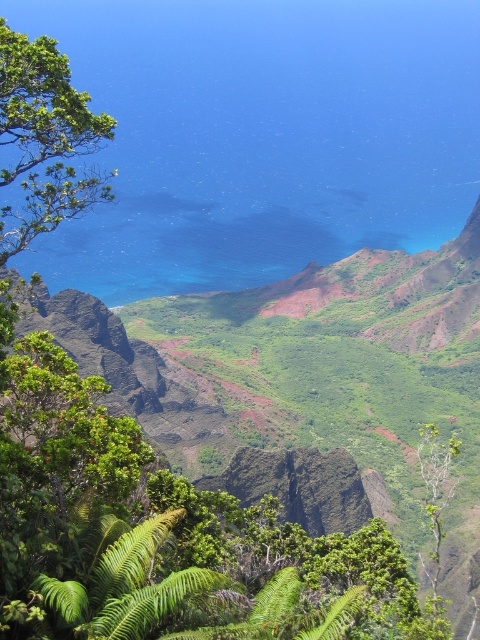
Question: Which point is closer to the camera taking this photo?

Choices:
 (A) (27, 209)
 (B) (195, 44)

Answer: (A)

Question: Is blue water at center below green leafy tree at upper left?

Choices:
 (A) yes
 (B) no

Answer: (B)

Question: Can you confirm if blue water at center is positioned below green leafy tree at upper left?

Choices:
 (A) no
 (B) yes

Answer: (A)

Question: Which of the following is the closest to the observer?

Choices:
 (A) blue water at center
 (B) green leafy tree at upper left

Answer: (B)

Question: Is blue water at center above green leafy tree at upper left?

Choices:
 (A) yes
 (B) no

Answer: (A)

Question: Which object appears farthest from the camera in this image?

Choices:
 (A) green leafy tree at upper left
 (B) blue water at center

Answer: (B)